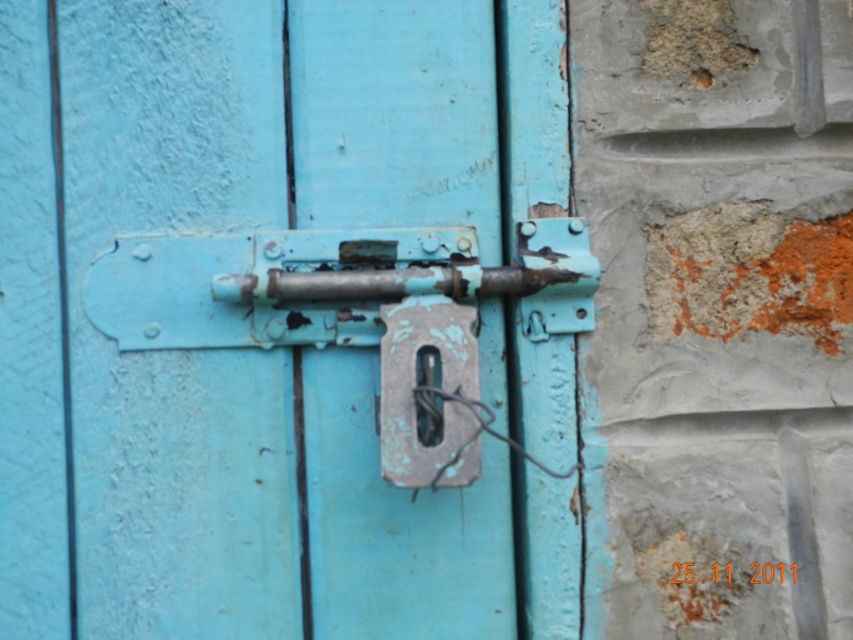
You are trying to determine which object is closer to you between the rusty metal lock at center and the rusty metal padlock at center. Based on the scene, which one is nearer?

The rusty metal lock at center is closer to you than the rusty metal padlock at center because it is positioned further to the viewer.

You are a locksmith examining two rusty metal items on a door. You have a tool that can only fit through a space narrower than 5 cm. The rusty metal lock at center and the rusty metal padlock at center are both in your view. Which one can your tool potentially fit through based on their widths?

The rusty metal padlock at center is narrower than the rusty metal lock at center, so the tool can fit through the rusty metal padlock at center if its width is under 5 cm.

You are trying to determine the order of the rusty metal lock at center and the rusty metal padlock at center on the door. Which one is positioned higher?

The rusty metal lock at center is located above the rusty metal padlock at center, so the rusty metal lock at center is higher up.